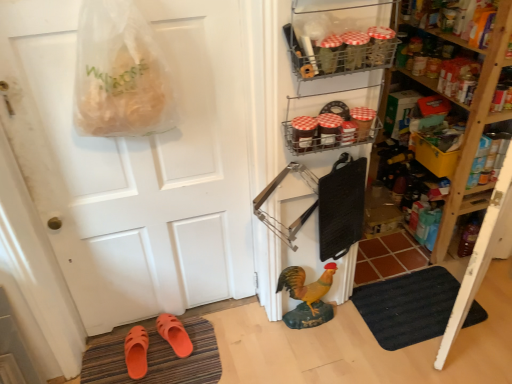
This screenshot has width=512, height=384. Find the location of `clear plastic grocery bag at upper left`. clear plastic grocery bag at upper left is located at coordinates (120, 73).

Identify the location of metallic wire rack at upper center, which is the second shelf from left to right. (327, 130).

The height and width of the screenshot is (384, 512). What do you see at coordinates (174, 334) in the screenshot?
I see `orange rubber slippers at lower left, which is the second footwear from left to right` at bounding box center [174, 334].

What is the approximate height of orange rubber doormat at lower left, positioned as the second doormat in right-to-left order?

It is 1.13 inches.

The height and width of the screenshot is (384, 512). Describe the element at coordinates (156, 359) in the screenshot. I see `orange rubber doormat at lower left, positioned as the second doormat in right-to-left order` at that location.

Where is `clear plastic grocery bag at upper left`? The image size is (512, 384). clear plastic grocery bag at upper left is located at coordinates (120, 73).

How different are the orientations of metallic wire rack at upper right, the first shelf in the left-to-right sequence, and painted wood rooster at lower center in degrees?

The angle between the facing direction of metallic wire rack at upper right, the first shelf in the left-to-right sequence, and the facing direction of painted wood rooster at lower center is 0.000988 degrees.

Looking at this image, could you measure the distance between metallic wire rack at upper right, which is the 3th shelf from right to left, and painted wood rooster at lower center?

metallic wire rack at upper right, which is the 3th shelf from right to left, and painted wood rooster at lower center are 38.14 inches apart from each other.

Considering the sizes of metallic wire rack at upper right, the first shelf in the left-to-right sequence, and painted wood rooster at lower center in the image, is metallic wire rack at upper right, the first shelf in the left-to-right sequence, bigger or smaller than painted wood rooster at lower center?

metallic wire rack at upper right, the first shelf in the left-to-right sequence, is smaller than painted wood rooster at lower center.

In the scene shown: Is metallic wire rack at upper right, the third shelf viewed from the back, turned away from painted wood rooster at lower center?

metallic wire rack at upper right, the third shelf viewed from the back, is not turned away from painted wood rooster at lower center.

Is point (312, 133) closer or farther from the camera than point (303, 295)?

Point (312, 133) appears to be closer to the viewer than point (303, 295).

Between metallic wire rack at upper center, acting as the 2th shelf starting from the back, and painted wood rooster at lower center, which one has larger width?

metallic wire rack at upper center, acting as the 2th shelf starting from the back, is wider.

Locate an element on the screen. the 2nd shelf counting from the right side of the painted wood rooster at lower center is located at coordinates (327, 130).

Is metallic wire rack at upper center, acting as the 2th shelf starting from the back, far from painted wood rooster at lower center?

Actually, metallic wire rack at upper center, acting as the 2th shelf starting from the back, and painted wood rooster at lower center are a little close together.

Is painted wood rooster at lower center oriented towards clear plastic grocery bag at upper left?

No.

This screenshot has width=512, height=384. In order to click on chicken lying behind the clear plastic grocery bag at upper left in this screenshot , I will do `click(306, 285)`.

From a real-world perspective, relative to clear plastic grocery bag at upper left, is painted wood rooster at lower center vertically above or below?

From a real-world perspective, painted wood rooster at lower center is physically below clear plastic grocery bag at upper left.

From the picture: Is wooden shelves at right, the 3th shelf positioned from the front, to the right of metallic wire rack at upper center, marked as the 2th shelf in a front-to-back arrangement, from the viewer's perspective?

Yes.

Is wooden shelves at right, which appears as the third shelf when viewed from the left, in front of or behind metallic wire rack at upper center, the 2th shelf positioned from the right, in the image?

In the image, wooden shelves at right, which appears as the third shelf when viewed from the left, appears behind metallic wire rack at upper center, the 2th shelf positioned from the right.

Would you consider wooden shelves at right, the 3th shelf positioned from the front, to be distant from metallic wire rack at upper center, the 2th shelf positioned from the right?

Actually, wooden shelves at right, the 3th shelf positioned from the front, and metallic wire rack at upper center, the 2th shelf positioned from the right, are a little close together.

From a real-world perspective, is wooden shelves at right, the 3th shelf positioned from the front, over metallic wire rack at upper center, the 2th shelf positioned from the right?

No, from a real-world perspective, wooden shelves at right, the 3th shelf positioned from the front, is not on top of metallic wire rack at upper center, the 2th shelf positioned from the right.

Can you confirm if clear plastic grocery bag at upper left is shorter than metallic wire rack at upper center, the 2th shelf positioned from the right?

Incorrect, the height of clear plastic grocery bag at upper left does not fall short of that of metallic wire rack at upper center, the 2th shelf positioned from the right.

From the image's perspective, which object appears higher, clear plastic grocery bag at upper left or metallic wire rack at upper center, which is the second shelf from left to right?

clear plastic grocery bag at upper left appears higher in the image.

Is clear plastic grocery bag at upper left surrounding metallic wire rack at upper center, acting as the 2th shelf starting from the back?

Actually, metallic wire rack at upper center, acting as the 2th shelf starting from the back, is outside clear plastic grocery bag at upper left.

Between point (96, 62) and point (375, 122), which one is positioned in front?

Point (96, 62)

From the image's perspective, does metallic wire rack at upper center, which is the second shelf from left to right, appear lower than white matte door at center?

Actually, metallic wire rack at upper center, which is the second shelf from left to right, appears above white matte door at center in the image.

Considering the sizes of objects metallic wire rack at upper center, which is the second shelf from left to right, and white matte door at center in the image provided, who is taller, metallic wire rack at upper center, which is the second shelf from left to right, or white matte door at center?

Standing taller between the two is white matte door at center.

Is metallic wire rack at upper center, which is the second shelf from left to right, facing towards white matte door at center?

No.

Choose the correct answer: Is metallic wire rack at upper center, which is the second shelf from left to right, inside white matte door at center or outside it?

metallic wire rack at upper center, which is the second shelf from left to right, exists outside the volume of white matte door at center.

Is wooden shelves at right, the 3th shelf positioned from the front, oriented away from orange rubber slippers at lower left, the first footwear when ordered from left to right?

No, orange rubber slippers at lower left, the first footwear when ordered from left to right, is not at the back of wooden shelves at right, the 3th shelf positioned from the front.

From the image's perspective, is wooden shelves at right, which appears as the third shelf when viewed from the left, below orange rubber slippers at lower left, which ranks as the 2th footwear in right-to-left order?

No.

Is wooden shelves at right, marked as the first shelf in a back-to-front arrangement, to the right of orange rubber slippers at lower left, which ranks as the 2th footwear in right-to-left order, from the viewer's perspective?

Yes, wooden shelves at right, marked as the first shelf in a back-to-front arrangement, is to the right of orange rubber slippers at lower left, which ranks as the 2th footwear in right-to-left order.

Is wooden shelves at right, which appears as the third shelf when viewed from the left, with orange rubber slippers at lower left, which ranks as the 2th footwear in right-to-left order?

No, wooden shelves at right, which appears as the third shelf when viewed from the left, is not touching orange rubber slippers at lower left, which ranks as the 2th footwear in right-to-left order.

In the image, there is a metallic wire rack at upper right, the 1th shelf viewed from the front. Where is `chicken below it (from a real-world perspective)`? chicken below it (from a real-world perspective) is located at coordinates (306, 285).

Image resolution: width=512 pixels, height=384 pixels. In order to click on chicken below the metallic wire rack at upper center, the 2th shelf positioned from the right (from the image's perspective) in this screenshot , I will do `click(306, 285)`.

Which object lies nearer to the anchor point painted wood rooster at lower center, orange rubber doormat at lower left, arranged as the first doormat when viewed from the left, or black rubber doormat at lower right, placed as the 2th doormat when sorted from left to right?

Among the two, black rubber doormat at lower right, placed as the 2th doormat when sorted from left to right, is located nearer to painted wood rooster at lower center.

When comparing their distances from metallic wire rack at upper right, the 1th shelf viewed from the front, does clear plastic grocery bag at upper left or painted wood rooster at lower center seem closer?

clear plastic grocery bag at upper left is positioned closer to the anchor metallic wire rack at upper right, the 1th shelf viewed from the front.

Estimate the real-world distances between objects in this image. Which object is further from painted wood rooster at lower center, orange rubber doormat at lower left, arranged as the first doormat when viewed from the left, or orange rubber slippers at lower left, arranged as the 1th footwear when viewed from the right?

Among the two, orange rubber doormat at lower left, arranged as the first doormat when viewed from the left, is located further to painted wood rooster at lower center.

When comparing their distances from metallic wire rack at upper right, the 1th shelf viewed from the front, does wooden shelves at right, marked as the first shelf in a back-to-front arrangement, or black rubber doormat at lower right, the first doormat positioned from the right, seem closer?

Based on the image, wooden shelves at right, marked as the first shelf in a back-to-front arrangement, appears to be nearer to metallic wire rack at upper right, the 1th shelf viewed from the front.

Which object lies further to the anchor point white matte door at center, orange rubber slippers at lower left, which is the second footwear from left to right, or clear plastic grocery bag at upper left?

orange rubber slippers at lower left, which is the second footwear from left to right, is further to white matte door at center.

Looking at the image, which one is located closer to painted wood rooster at lower center, black rubber doormat at lower right, placed as the 2th doormat when sorted from left to right, or metallic wire rack at upper right, the 1th shelf viewed from the front?

Among the two, black rubber doormat at lower right, placed as the 2th doormat when sorted from left to right, is located nearer to painted wood rooster at lower center.

Considering their positions, is clear plastic grocery bag at upper left positioned closer to black rubber doormat at lower right, placed as the 2th doormat when sorted from left to right, than wooden shelves at right, marked as the first shelf in a back-to-front arrangement?

wooden shelves at right, marked as the first shelf in a back-to-front arrangement, is closer to black rubber doormat at lower right, placed as the 2th doormat when sorted from left to right.

Estimate the real-world distances between objects in this image. Which object is closer to orange rubber slippers at lower left, which ranks as the 2th footwear in right-to-left order, orange rubber doormat at lower left, arranged as the first doormat when viewed from the left, or orange rubber slippers at lower left, which is the second footwear from left to right?

The object closer to orange rubber slippers at lower left, which ranks as the 2th footwear in right-to-left order, is orange rubber doormat at lower left, arranged as the first doormat when viewed from the left.

The width and height of the screenshot is (512, 384). Identify the location of footwear situated between orange rubber doormat at lower left, positioned as the second doormat in right-to-left order, and painted wood rooster at lower center from left to right. (174, 334).

Where is `doormat located between orange rubber slippers at lower left, which is the second footwear from left to right, and wooden shelves at right, which is counted as the first shelf, starting from the right, in the left-right direction`? doormat located between orange rubber slippers at lower left, which is the second footwear from left to right, and wooden shelves at right, which is counted as the first shelf, starting from the right, in the left-right direction is located at coordinates (407, 306).

At what (x,y) coordinates should I click in order to perform the action: click on footwear between orange rubber slippers at lower left, which ranks as the 2th footwear in right-to-left order, and wooden shelves at right, the 3th shelf positioned from the front, from left to right. Please return your answer as a coordinate pair (x, y). The height and width of the screenshot is (384, 512). Looking at the image, I should click on (174, 334).

Where is `chicken between clear plastic grocery bag at upper left and orange rubber slippers at lower left, arranged as the 1th footwear when viewed from the right, in the vertical direction`? This screenshot has height=384, width=512. chicken between clear plastic grocery bag at upper left and orange rubber slippers at lower left, arranged as the 1th footwear when viewed from the right, in the vertical direction is located at coordinates (306, 285).